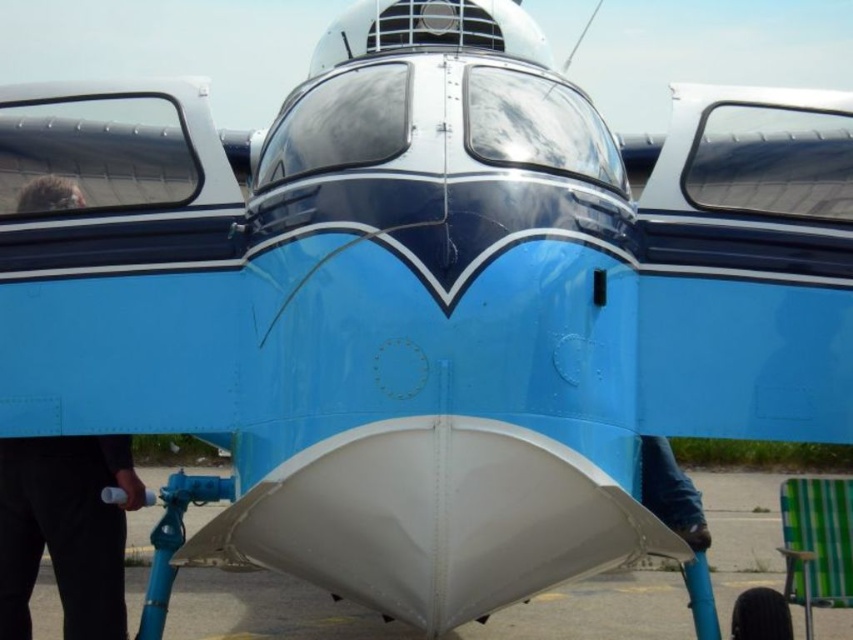
Looking at this image, you are a pilot preparing for takeoff and notice the white matte tarmac at center and the black matte hair at left in your line of sight. Which object is positioned lower from your perspective?

The white matte tarmac at center is below black matte hair at left, so the white matte tarmac at center is positioned lower from your perspective.

From the picture: You are a pilot preparing for takeoff and notice the white matte tarmac at center and the black matte hair at left in your line of sight. Which object is closer to your cockpit windshield?

The white matte tarmac at center is closer to the cockpit windshield because it is further to the viewer than the black matte hair at left, meaning it appears nearer in the visual perspective.